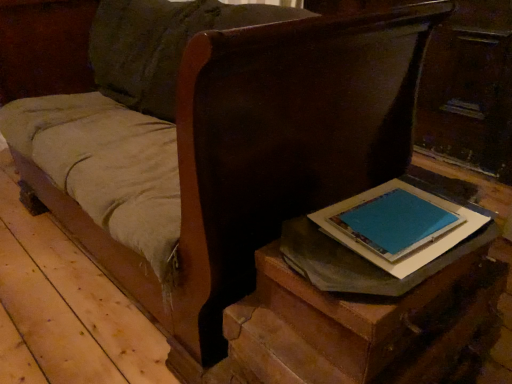
This screenshot has width=512, height=384. Describe the element at coordinates (349, 327) in the screenshot. I see `matte brown table at lower right` at that location.

This screenshot has height=384, width=512. Identify the location of matte brown table at lower right. (349, 327).

Describe the element at coordinates (399, 225) in the screenshot. I see `blue paper at right` at that location.

Identify the location of blue paper at right. (399, 225).

Find the location of a particular element. matte brown table at lower right is located at coordinates (349, 327).

Between blue paper at right and matte brown table at lower right, which one appears on the right side from the viewer's perspective?

From the viewer's perspective, blue paper at right appears more on the right side.

Based on the photo, is the depth of blue paper at right less than that of matte brown table at lower right?

That is False.

Does point (472, 219) lie behind point (447, 297)?

Yes, point (472, 219) is behind point (447, 297).

From the image's perspective, which object appears higher, blue paper at right or matte brown table at lower right?

blue paper at right appears higher in the image.

From a real-world perspective, is blue paper at right positioned under matte brown table at lower right based on gravity?

No, from a real-world perspective, blue paper at right is not below matte brown table at lower right.

Considering the relative sizes of blue paper at right and matte brown table at lower right in the image provided, is blue paper at right thinner than matte brown table at lower right?

Yes.

Between blue paper at right and matte brown table at lower right, which one has more height?

matte brown table at lower right.

Looking at the image, does blue paper at right seem bigger or smaller compared to matte brown table at lower right?

Clearly, blue paper at right is smaller in size than matte brown table at lower right.

Would you say matte brown table at lower right is part of blue paper at right's contents?

Definitely not — matte brown table at lower right is not inside blue paper at right.

Are blue paper at right and matte brown table at lower right making contact?

No, blue paper at right is not next to matte brown table at lower right.

Is blue paper at right looking in the opposite direction of matte brown table at lower right?

Correct, blue paper at right is looking away from matte brown table at lower right.

What's the angular difference between blue paper at right and matte brown table at lower right's facing directions?

The facing directions of blue paper at right and matte brown table at lower right are 8.02 degrees apart.

You are a GUI agent. You are given a task and a screenshot of the screen. Output one action in this format:
    pyautogui.click(x=<x>, y=<y>)
    Task: Click on the paperback book positioned vertically above the matte brown table at lower right (from a real-world perspective)
    The image size is (512, 384).
    Given the screenshot: What is the action you would take?
    pyautogui.click(x=399, y=225)

Considering the positions of objects matte brown table at lower right and blue paper at right in the image provided, who is more to the right, matte brown table at lower right or blue paper at right?

From the viewer's perspective, blue paper at right appears more on the right side.

Is the depth of matte brown table at lower right greater than that of blue paper at right?

No, matte brown table at lower right is closer to the camera.

Considering the positions of point (444, 345) and point (374, 224), is point (444, 345) closer or farther from the camera than point (374, 224)?

Clearly, point (444, 345) is closer to the camera than point (374, 224).

From the image's perspective, which object appears higher, matte brown table at lower right or blue paper at right?

blue paper at right, from the image's perspective.

From a real-world perspective, is matte brown table at lower right below blue paper at right?

Correct, in the physical world, matte brown table at lower right is lower than blue paper at right.

Does matte brown table at lower right have a lesser width compared to blue paper at right?

Incorrect, the width of matte brown table at lower right is not less than that of blue paper at right.

Considering the sizes of objects matte brown table at lower right and blue paper at right in the image provided, who is taller, matte brown table at lower right or blue paper at right?

matte brown table at lower right.

Considering the sizes of objects matte brown table at lower right and blue paper at right in the image provided, who is bigger, matte brown table at lower right or blue paper at right?

matte brown table at lower right is bigger.

Is matte brown table at lower right positioned beyond the bounds of blue paper at right?

Indeed, matte brown table at lower right is completely outside blue paper at right.

Is matte brown table at lower right not close to blue paper at right?

No, matte brown table at lower right is not far away from blue paper at right.

Is matte brown table at lower right turned away from blue paper at right?

That's not correct — matte brown table at lower right is not looking away from blue paper at right.

You are a GUI agent. You are given a task and a screenshot of the screen. Output one action in this format:
    pyautogui.click(x=<x>, y=<y>)
    Task: Click on the paperback book above the matte brown table at lower right (from a real-world perspective)
    The width and height of the screenshot is (512, 384).
    Given the screenshot: What is the action you would take?
    pyautogui.click(x=399, y=225)

The height and width of the screenshot is (384, 512). I want to click on table beneath the blue paper at right (from a real-world perspective), so click(349, 327).

Locate an element on the screen. This screenshot has width=512, height=384. table below the blue paper at right (from the image's perspective) is located at coordinates (349, 327).